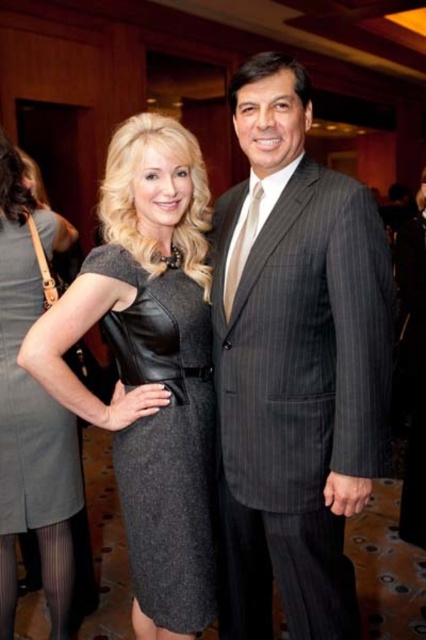
Does gray pinstripe suit at right come behind black leather dress at center?

No, gray pinstripe suit at right is closer to the viewer.

From the picture: Is gray pinstripe suit at right positioned before black leather dress at center?

Yes.

Which is in front, point (230, 477) or point (172, 394)?

Point (172, 394) is more forward.

I want to click on gray pinstripe suit at right, so click(294, 365).

Is gray pinstripe suit at right taller than gray leather dress at center?

Yes, gray pinstripe suit at right is taller than gray leather dress at center.

Between point (244, 90) and point (25, 525), which one is positioned in front?

Point (244, 90)

Is point (371, 401) closer to viewer compared to point (49, 497)?

Yes.

Where is `gray pinstripe suit at right`? gray pinstripe suit at right is located at coordinates (294, 365).

Is black leather dress at center smaller than gray leather dress at center?

No, black leather dress at center is not smaller than gray leather dress at center.

In the scene shown: Measure the distance from black leather dress at center to gray leather dress at center.

black leather dress at center and gray leather dress at center are 19.78 inches apart.

Who is more forward, [144,524] or [51,492]?

Point [144,524]

Locate an element on the screen. The image size is (426, 640). black leather dress at center is located at coordinates (166, 440).